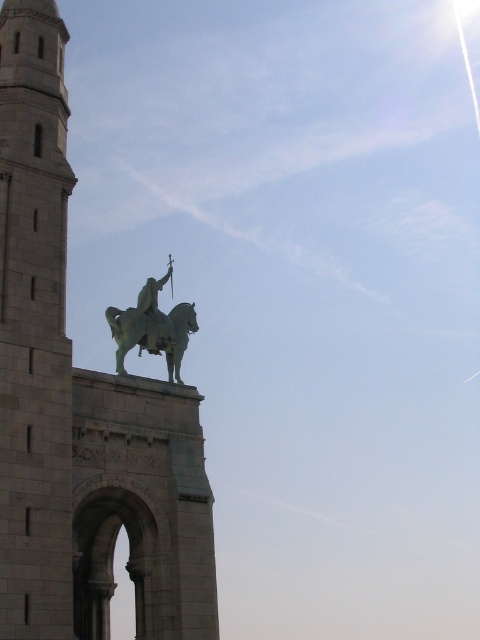
Question: Can you confirm if gray stone tower at upper left is wider than green polished metal statue at upper center?

Choices:
 (A) no
 (B) yes

Answer: (B)

Question: Does gray stone tower at center have a lesser width compared to green polished metal statue at upper center?

Choices:
 (A) no
 (B) yes

Answer: (A)

Question: Which point is closer to the camera taking this photo?

Choices:
 (A) (64, 349)
 (B) (38, 273)
 (C) (143, 346)

Answer: (A)

Question: Is gray stone tower at upper left positioned in front of green polished metal statue at upper center?

Choices:
 (A) no
 (B) yes

Answer: (B)

Question: Estimate the real-world distances between objects in this image. Which object is farther from the gray stone tower at upper left?

Choices:
 (A) green polished metal statue at upper center
 (B) gray stone tower at center

Answer: (A)

Question: Which point appears farthest from the camera in this image?

Choices:
 (A) (149, 301)
 (B) (39, 316)
 (C) (19, 141)

Answer: (A)